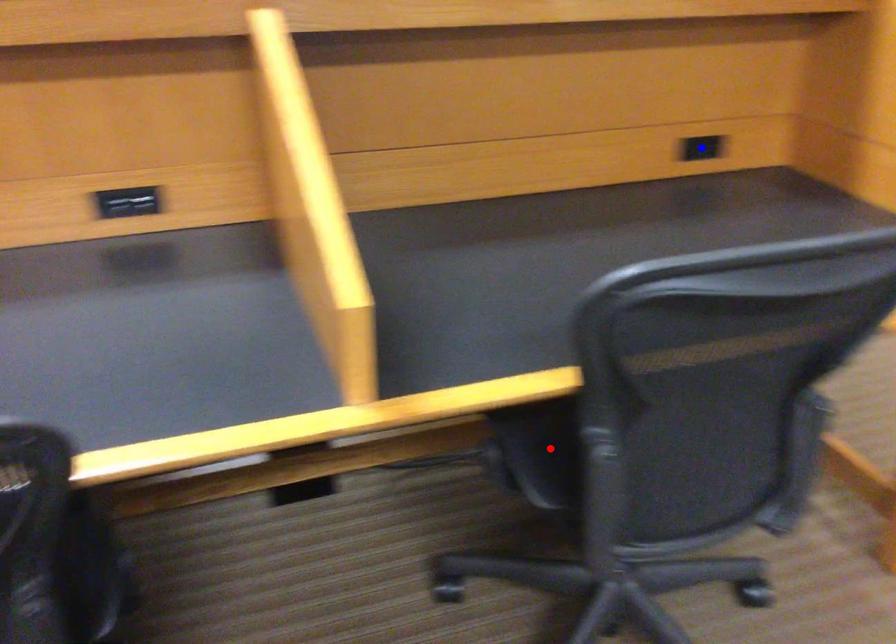
Question: Which of the two points in the image is closer to the camera?

Choices:
 (A) Blue point is closer.
 (B) Red point is closer.

Answer: (B)